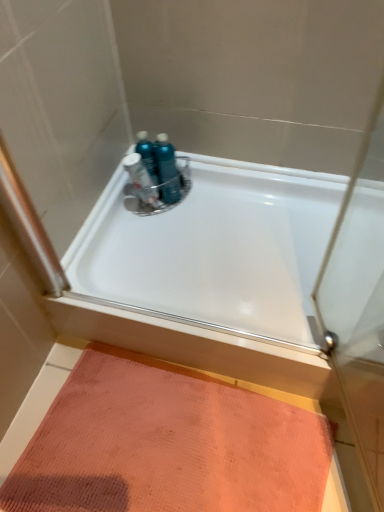
Where is `vacant area that is in front of blue glossy bottles at upper center, the second toiletry positioned from the right`? vacant area that is in front of blue glossy bottles at upper center, the second toiletry positioned from the right is located at coordinates (156, 225).